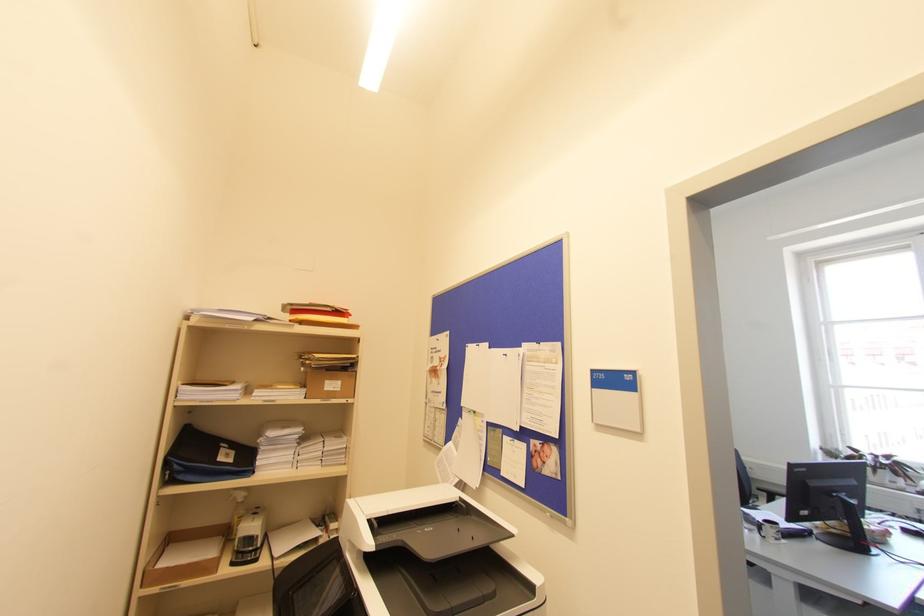
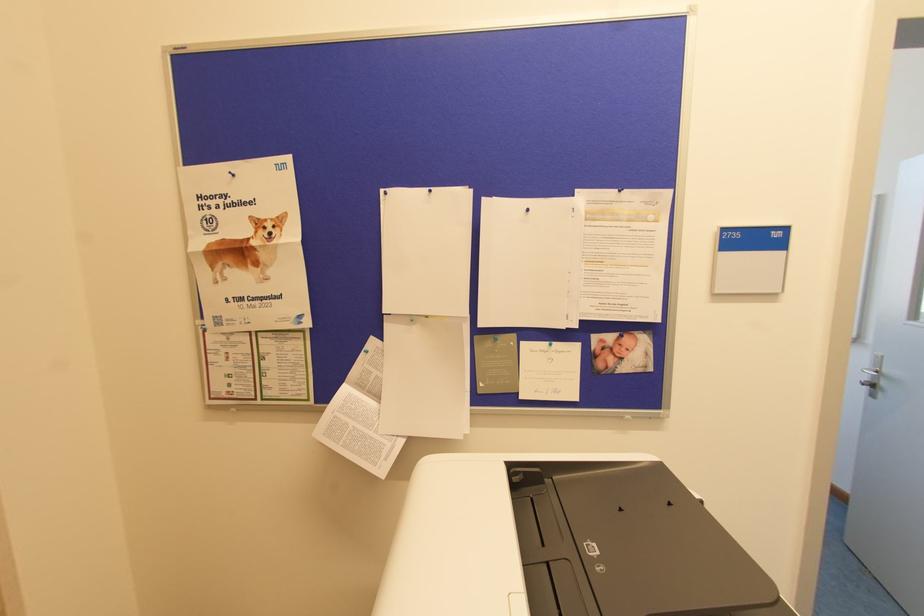
In the second image, find the point that corresponds to (460,405) in the first image.

(383, 312)